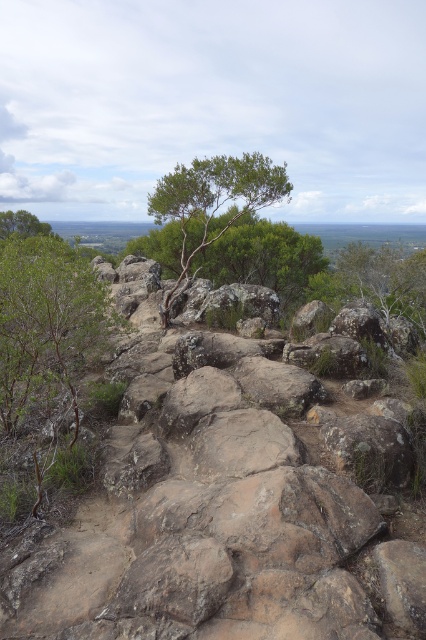
Question: Which point is farther to the camera?

Choices:
 (A) (199, 216)
 (B) (120, 394)

Answer: (A)

Question: Which of these objects is positioned farthest from the green leafy tree at center?

Choices:
 (A) rusty stone boulder at center
 (B) green leafy tree at upper left

Answer: (B)

Question: Is green leafy tree at center bigger than green leafy tree at upper left?

Choices:
 (A) no
 (B) yes

Answer: (B)

Question: Which object is positioned closest to the rusty stone boulder at center?

Choices:
 (A) green leafy tree at center
 (B) green leafy tree at upper left

Answer: (A)

Question: Can you confirm if rusty stone boulder at center is positioned to the left of green leafy tree at center?

Choices:
 (A) no
 (B) yes

Answer: (A)

Question: Where is green leafy tree at center located in relation to green leafy tree at upper left in the image?

Choices:
 (A) above
 (B) below

Answer: (B)